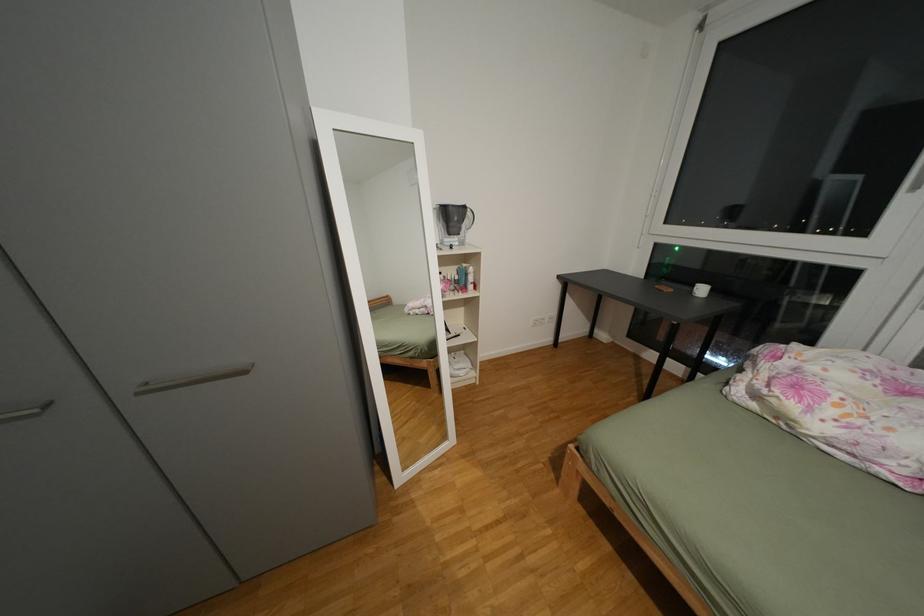
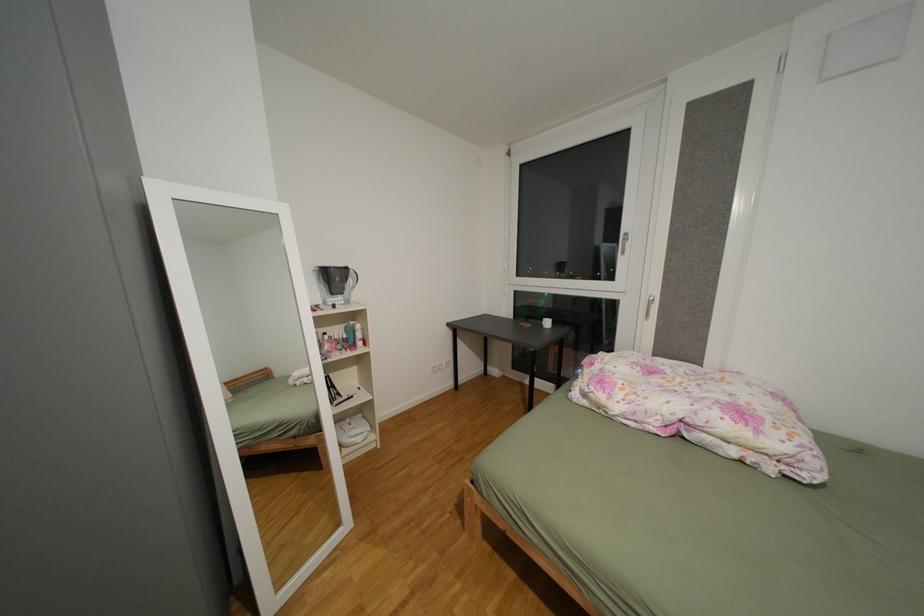
In the scene shown: Which direction would the cameraman need to move to produce the second image?

The movement direction of the cameraman is right, backward.